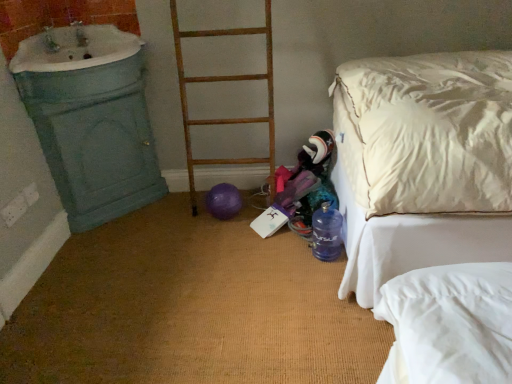
At what (x,y) coordinates should I click in order to perform the action: click on translucent blue bottle at lower right. Please return your answer as a coordinate pair (x, y). This screenshot has width=512, height=384. Looking at the image, I should click on (327, 233).

Describe the element at coordinates (422, 163) in the screenshot. I see `white satin bed at right` at that location.

The image size is (512, 384). I want to click on white satin bed at right, so click(422, 163).

I want to click on purple rubber balloon at center, so click(223, 201).

In the image, is rusty wood ladder at center positioned in front of or behind purple rubber balloon at center?

Clearly, rusty wood ladder at center is in front of purple rubber balloon at center.

Is rusty wood ladder at center located outside purple rubber balloon at center?

Absolutely, rusty wood ladder at center is external to purple rubber balloon at center.

Would you say rusty wood ladder at center is a long distance from purple rubber balloon at center?

Actually, rusty wood ladder at center and purple rubber balloon at center are a little close together.

Is rusty wood ladder at center bigger than white porcelain sink at upper left?

Yes, rusty wood ladder at center is bigger than white porcelain sink at upper left.

Can you tell me how much rusty wood ladder at center and white porcelain sink at upper left differ in facing direction?

There is a 0.000363-degree angle between the facing directions of rusty wood ladder at center and white porcelain sink at upper left.

From the image's perspective, would you say rusty wood ladder at center is shown under white porcelain sink at upper left?

Correct, rusty wood ladder at center appears lower than white porcelain sink at upper left in the image.

Is the position of rusty wood ladder at center more distant than that of white porcelain sink at upper left?

Yes, the depth of rusty wood ladder at center is greater than that of white porcelain sink at upper left.

Relative to purple rubber balloon at center, is white porcelain sink at upper left in front or behind?

white porcelain sink at upper left is positioned closer to the viewer than purple rubber balloon at center.

From a real-world perspective, which object stands above the other?

white porcelain sink at upper left is physically above.

Is white porcelain sink at upper left oriented towards purple rubber balloon at center?

No, white porcelain sink at upper left is not turned towards purple rubber balloon at center.

The image size is (512, 384). What are the coordinates of `sink positioned vertically above the purple rubber balloon at center (from a real-world perspective)` in the screenshot? It's located at (74, 48).

Considering the relative sizes of white porcelain sink at upper left and white satin bed at right in the image provided, is white porcelain sink at upper left thinner than white satin bed at right?

Yes.

Between white porcelain sink at upper left and white satin bed at right, which one appears on the left side from the viewer's perspective?

white porcelain sink at upper left.

From the image's perspective, is white porcelain sink at upper left beneath white satin bed at right?

No, from the image's perspective, white porcelain sink at upper left is not beneath white satin bed at right.

Based on the photo, which object is more forward, white porcelain sink at upper left or white satin bed at right?

A: white satin bed at right.

Considering the positions of objects purple rubber balloon at center and white satin bed at right in the image provided, who is behind, purple rubber balloon at center or white satin bed at right?

Positioned behind is purple rubber balloon at center.

Between purple rubber balloon at center and white satin bed at right, which one appears on the right side from the viewer's perspective?

Positioned to the right is white satin bed at right.

Is white satin bed at right at the back of purple rubber balloon at center?

That's not correct — purple rubber balloon at center is not looking away from white satin bed at right.

Can you tell me how much purple rubber balloon at center and white satin bed at right differ in facing direction?

96.5 degrees.

How different are the orientations of translucent blue bottle at lower right and white satin bed at right in degrees?

The angle between the facing direction of translucent blue bottle at lower right and the facing direction of white satin bed at right is 0.384 degrees.

Is translucent blue bottle at lower right behind white satin bed at right?

Yes, translucent blue bottle at lower right is behind white satin bed at right.

From a real-world perspective, is translucent blue bottle at lower right positioned under white satin bed at right based on gravity?

Yes, from a real-world perspective, translucent blue bottle at lower right is under white satin bed at right.

From the image's perspective, relative to white satin bed at right, is translucent blue bottle at lower right above or below?

From the image's perspective, translucent blue bottle at lower right appears below white satin bed at right.

Is white satin bed at right located outside rusty wood ladder at center?

Yes.

Can you confirm if white satin bed at right is positioned to the left of rusty wood ladder at center?

In fact, white satin bed at right is to the right of rusty wood ladder at center.

How many degrees apart are the facing directions of white satin bed at right and rusty wood ladder at center?

white satin bed at right and rusty wood ladder at center are facing 91 degrees away from each other.

Does white satin bed at right have a greater width compared to rusty wood ladder at center?

Yes.

The image size is (512, 384). In order to click on balloon behind the rusty wood ladder at center in this screenshot , I will do [223, 201].

Find the location of a particular element. This screenshot has width=512, height=384. ladder to the right of white porcelain sink at upper left is located at coordinates (225, 81).

When comparing their distances from white satin bed at right, does translucent blue bottle at lower right or purple rubber balloon at center seem further?

purple rubber balloon at center.

Which object lies nearer to the anchor point white porcelain sink at upper left, purple rubber balloon at center or rusty wood ladder at center?

rusty wood ladder at center is positioned closer to the anchor white porcelain sink at upper left.

Looking at the image, which one is located closer to translucent blue bottle at lower right, rusty wood ladder at center or white satin bed at right?

Among the two, rusty wood ladder at center is located nearer to translucent blue bottle at lower right.

Which object lies further to the anchor point translucent blue bottle at lower right, white satin bed at right or white porcelain sink at upper left?

Based on the image, white porcelain sink at upper left appears to be further to translucent blue bottle at lower right.

Considering their positions, is translucent blue bottle at lower right positioned further to rusty wood ladder at center than white satin bed at right?

Based on the image, white satin bed at right appears to be further to rusty wood ladder at center.

From the image, which object appears to be farther from rusty wood ladder at center, translucent blue bottle at lower right or purple rubber balloon at center?

Among the two, translucent blue bottle at lower right is located further to rusty wood ladder at center.

Based on their spatial positions, is purple rubber balloon at center or white satin bed at right further from translucent blue bottle at lower right?

white satin bed at right.

From the image, which object appears to be farther from white satin bed at right, translucent blue bottle at lower right or rusty wood ladder at center?

rusty wood ladder at center is positioned further to the anchor white satin bed at right.

Where is `ladder located between white porcelain sink at upper left and translucent blue bottle at lower right in the left-right direction`? The image size is (512, 384). ladder located between white porcelain sink at upper left and translucent blue bottle at lower right in the left-right direction is located at coordinates (225, 81).

The image size is (512, 384). Find the location of `balloon between white porcelain sink at upper left and translucent blue bottle at lower right from left to right`. balloon between white porcelain sink at upper left and translucent blue bottle at lower right from left to right is located at coordinates (223, 201).

The height and width of the screenshot is (384, 512). I want to click on bottle between white porcelain sink at upper left and white satin bed at right in the horizontal direction, so click(x=327, y=233).

Locate an element on the screen. balloon situated between white porcelain sink at upper left and white satin bed at right from left to right is located at coordinates (223, 201).